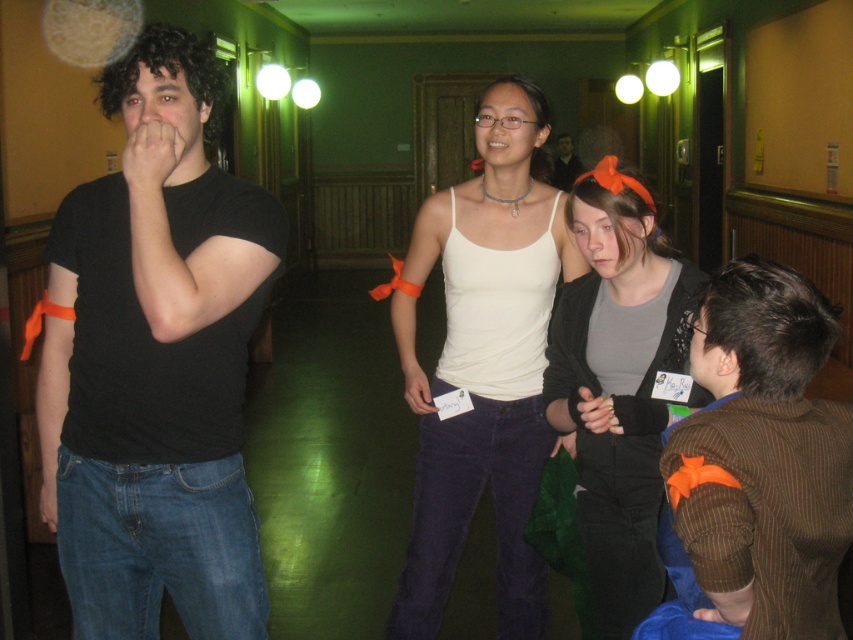
Based on the scene description, can you determine which clothing item, the white cotton tank top at center or the brown pinstripe sweater at lower right, is wider in the image?

The white cotton tank top at center is wider than the brown pinstripe sweater at lower right according to the description.

You are standing in the hallway and want to greet both the person wearing the white cotton tank top at center and the one in the brown pinstripe sweater at lower right. Which person should you approach first to reach them more quickly?

You should approach the white cotton tank top at center first because it is closer to you than the brown pinstripe sweater at lower right, so you can reach them more quickly.

You are trying to find the person wearing the brown pinstripe sweater at lower right and the matte gray sweater at center. Based on their positions, which one is located to the right of the other?

The brown pinstripe sweater at lower right is positioned on the right side of matte gray sweater at center.